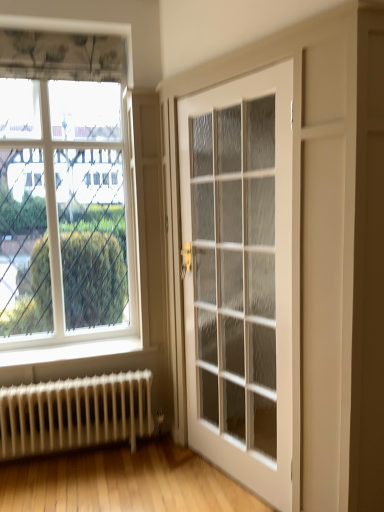
Question: From the image's perspective, is white glossy door at center above or below clear glass window at upper left?

Choices:
 (A) below
 (B) above

Answer: (A)

Question: From a real-world perspective, is white glossy door at center above or below clear glass window at upper left?

Choices:
 (A) above
 (B) below

Answer: (B)

Question: Which is farther from the clear glass window at upper left?

Choices:
 (A) white glossy door at center
 (B) white metal radiator at lower left

Answer: (A)

Question: Which is farther from the white metal radiator at lower left?

Choices:
 (A) white glossy door at center
 (B) clear glass window at upper left

Answer: (A)